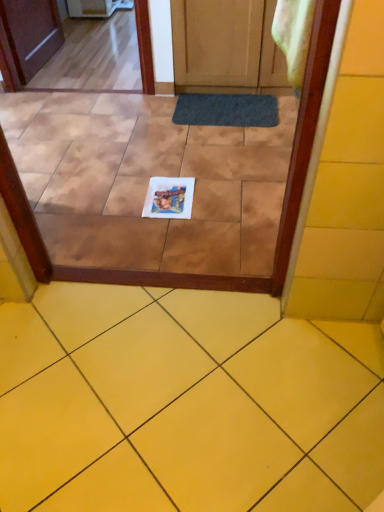
Question: Is white paper at center placed right next to dark gray rubber doormat at center?

Choices:
 (A) yes
 (B) no

Answer: (B)

Question: From a real-world perspective, is white paper at center positioned under dark gray rubber doormat at center based on gravity?

Choices:
 (A) yes
 (B) no

Answer: (A)

Question: Would you say white paper at center is a long distance from dark gray rubber doormat at center?

Choices:
 (A) yes
 (B) no

Answer: (A)

Question: Considering the relative sizes of white paper at center and dark gray rubber doormat at center in the image provided, is white paper at center thinner than dark gray rubber doormat at center?

Choices:
 (A) yes
 (B) no

Answer: (B)

Question: Is white paper at center wider than dark gray rubber doormat at center?

Choices:
 (A) yes
 (B) no

Answer: (A)

Question: Is white paper at center to the right of dark gray rubber doormat at center from the viewer's perspective?

Choices:
 (A) no
 (B) yes

Answer: (A)

Question: From a real-world perspective, is white paper at center located beneath white glossy coaster at center?

Choices:
 (A) yes
 (B) no

Answer: (B)

Question: Is white paper at center wider than white glossy coaster at center?

Choices:
 (A) no
 (B) yes

Answer: (B)

Question: Is white paper at center next to white glossy coaster at center?

Choices:
 (A) no
 (B) yes

Answer: (A)

Question: Considering the relative positions of white paper at center and white glossy coaster at center in the image provided, is white paper at center in front of white glossy coaster at center?

Choices:
 (A) yes
 (B) no

Answer: (A)

Question: Can you confirm if white paper at center is smaller than white glossy coaster at center?

Choices:
 (A) no
 (B) yes

Answer: (A)

Question: Considering the relative positions of white paper at center and white glossy coaster at center in the image provided, is white paper at center to the right of white glossy coaster at center from the viewer's perspective?

Choices:
 (A) no
 (B) yes

Answer: (A)

Question: Does white glossy coaster at center appear on the right side of dark gray rubber doormat at center?

Choices:
 (A) no
 (B) yes

Answer: (A)